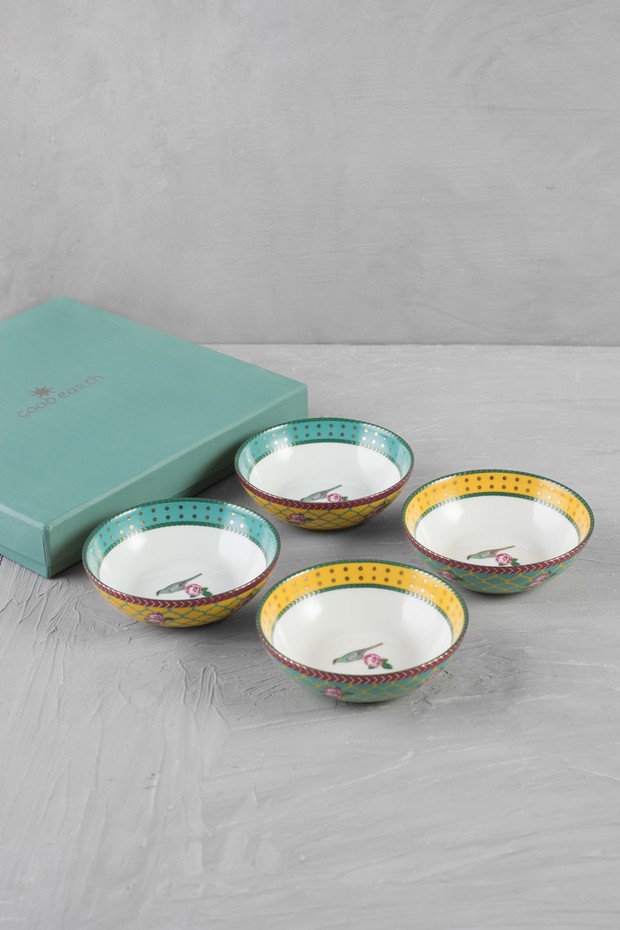
At what (x,y) coordinates should I click in order to perform the action: click on surface. Please return your answer as a coordinate pair (x, y). Looking at the image, I should click on (340, 764).